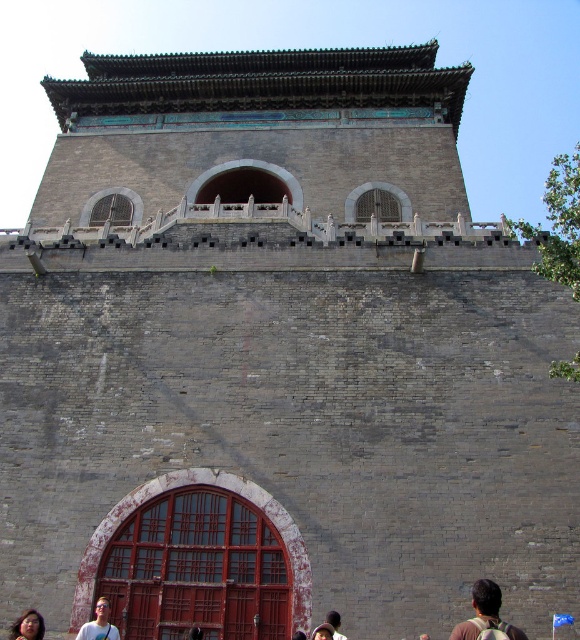
Is point (465, 628) positioned after point (96, 611)?

That is False.

Does point (487, 598) come closer to viewer compared to point (78, 637)?

Yes, point (487, 598) is closer to viewer.

Is point (465, 632) behind point (77, 634)?

That is False.

Where is `brown backpack at lower center`? brown backpack at lower center is located at coordinates (487, 600).

Who is higher up, brown backpack at lower center or brown leather hat at lower center?

brown backpack at lower center

Can you confirm if brown backpack at lower center is smaller than brown leather hat at lower center?

Actually, brown backpack at lower center might be larger than brown leather hat at lower center.

Who is more distant from viewer, (x=477, y=612) or (x=327, y=637)?

Point (x=327, y=637)

Locate an element on the screen. This screenshot has height=640, width=580. brown backpack at lower center is located at coordinates (487, 600).

What do you see at coordinates (99, 624) in the screenshot?
I see `matte blue shirt at lower center` at bounding box center [99, 624].

Which is in front, point (117, 628) or point (34, 634)?

Point (34, 634) is more forward.

Locate an element on the screen. This screenshot has height=640, width=580. matte blue shirt at lower center is located at coordinates (99, 624).